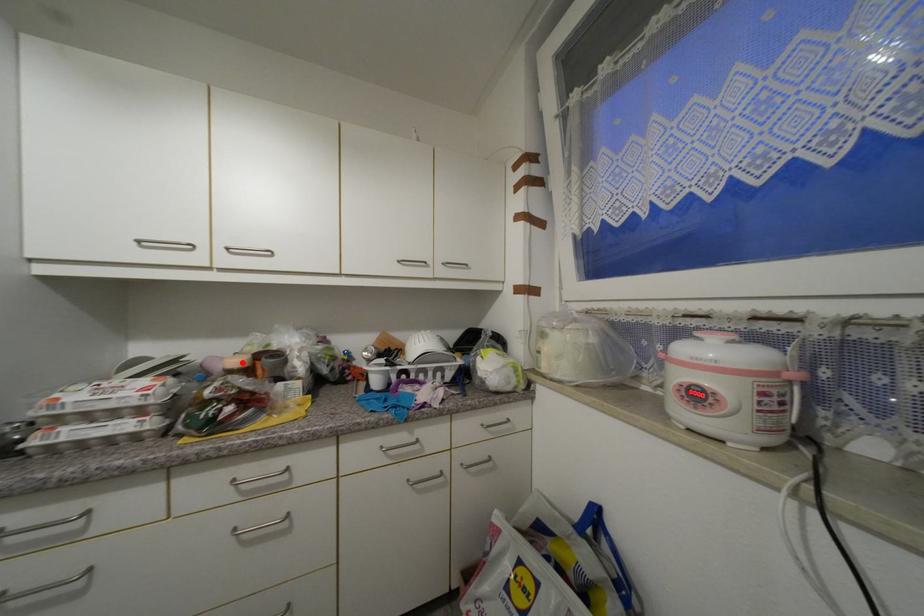
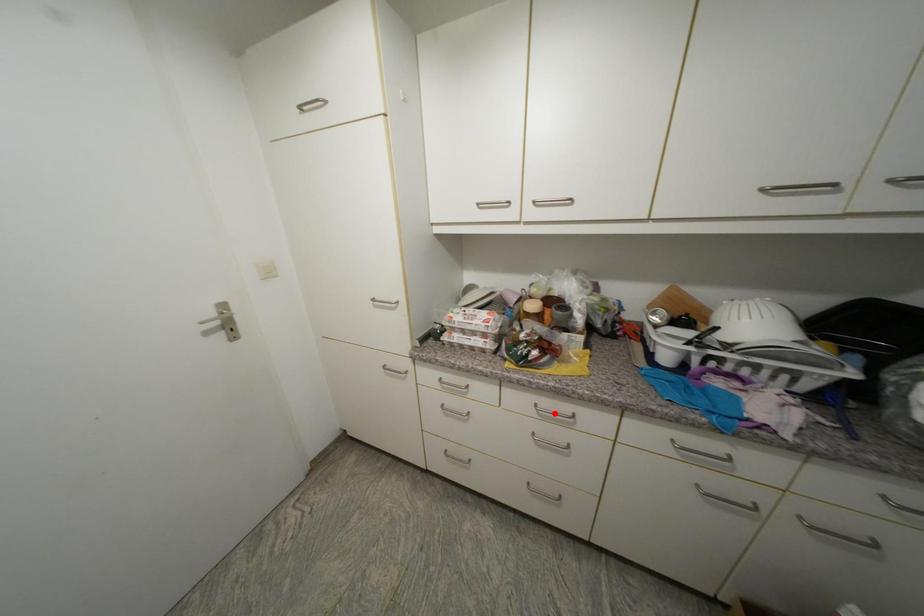
I am providing you with two images of the same scene from different viewpoints. A red point is marked on the first image and another point is marked on the second image. Is the red point in image1 aligned with the point shown in image2?

No